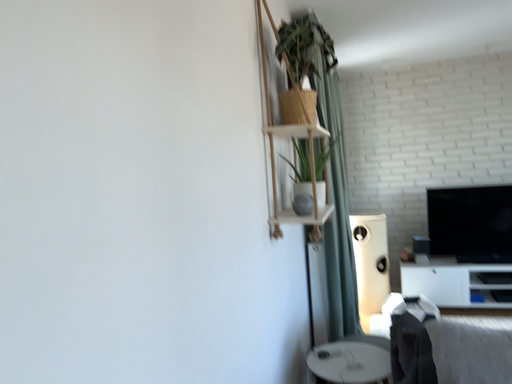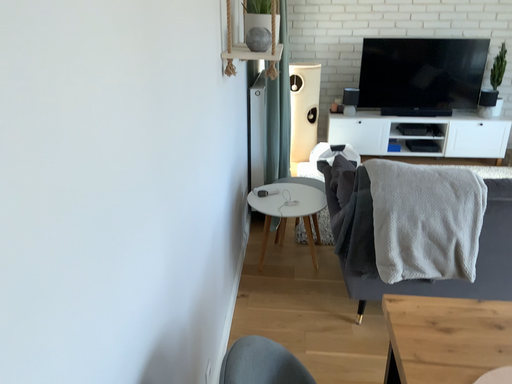
Question: How did the camera likely rotate when shooting the video?

Choices:
 (A) rotated right
 (B) rotated left

Answer: (A)